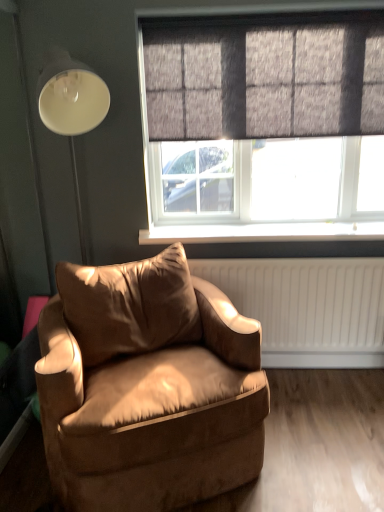
Find the location of a particular element. This screenshot has width=384, height=512. vacant region under dark grey textured curtain at upper center (from a real-world perspective) is located at coordinates (260, 225).